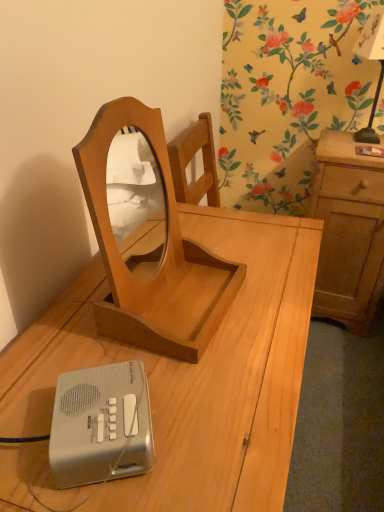
Question: Would you say light brown wood cabinet at right contains silver plastic ipod at lower left?

Choices:
 (A) no
 (B) yes

Answer: (A)

Question: From the image's perspective, is light brown wood cabinet at right over silver plastic ipod at lower left?

Choices:
 (A) no
 (B) yes

Answer: (B)

Question: Is light brown wood cabinet at right wider than silver plastic ipod at lower left?

Choices:
 (A) yes
 (B) no

Answer: (A)

Question: Is light brown wood cabinet at right outside of silver plastic ipod at lower left?

Choices:
 (A) yes
 (B) no

Answer: (A)

Question: Does light brown wood cabinet at right appear on the left side of silver plastic ipod at lower left?

Choices:
 (A) no
 (B) yes

Answer: (A)

Question: Is light brown wood cabinet at right bigger or smaller than black glass bedside lamp at upper right?

Choices:
 (A) big
 (B) small

Answer: (A)

Question: Is point (352, 144) closer or farther from the camera than point (379, 39)?

Choices:
 (A) closer
 (B) farther

Answer: (B)

Question: From the image's perspective, is light brown wood cabinet at right located above or below black glass bedside lamp at upper right?

Choices:
 (A) above
 (B) below

Answer: (B)

Question: From a real-world perspective, is light brown wood cabinet at right physically located above or below black glass bedside lamp at upper right?

Choices:
 (A) below
 (B) above

Answer: (A)

Question: From the image's perspective, is silver plastic ipod at lower left located above or below light brown wood cabinet at right?

Choices:
 (A) above
 (B) below

Answer: (B)

Question: In terms of height, does silver plastic ipod at lower left look taller or shorter compared to light brown wood cabinet at right?

Choices:
 (A) tall
 (B) short

Answer: (B)

Question: Choose the correct answer: Is silver plastic ipod at lower left inside light brown wood cabinet at right or outside it?

Choices:
 (A) outside
 (B) inside

Answer: (A)

Question: Is point (89, 422) positioned closer to the camera than point (382, 169)?

Choices:
 (A) farther
 (B) closer

Answer: (B)

Question: Relative to silver plastic ipod at lower left, is black glass bedside lamp at upper right in front or behind?

Choices:
 (A) front
 (B) behind

Answer: (B)

Question: Based on their positions, is black glass bedside lamp at upper right located to the left or right of silver plastic ipod at lower left?

Choices:
 (A) right
 (B) left

Answer: (A)